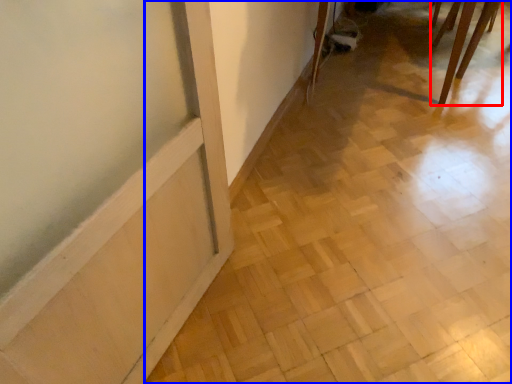
Question: Which object is further to the camera taking this photo, furniture (highlighted by a red box) or tile (highlighted by a blue box)?

Choices:
 (A) furniture
 (B) tile

Answer: (A)